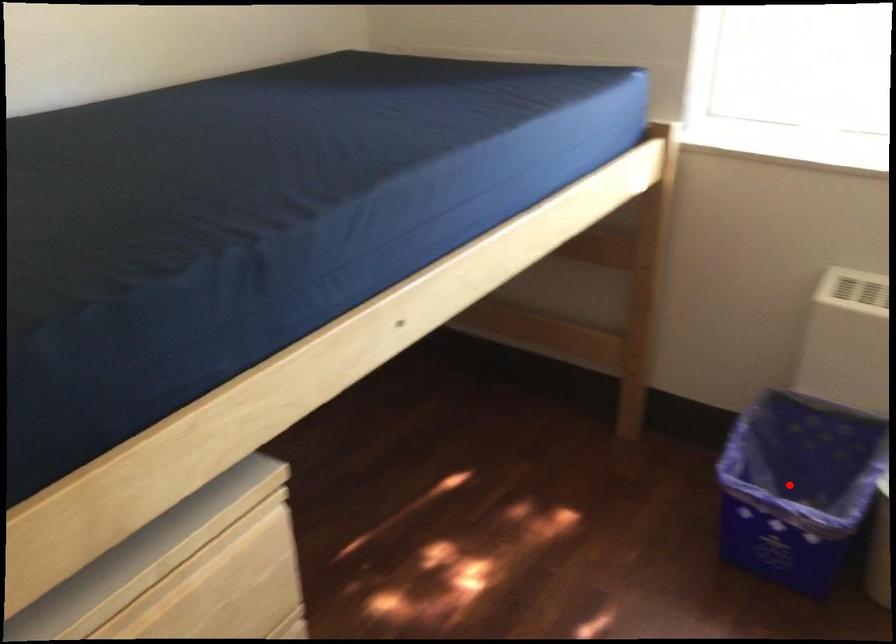
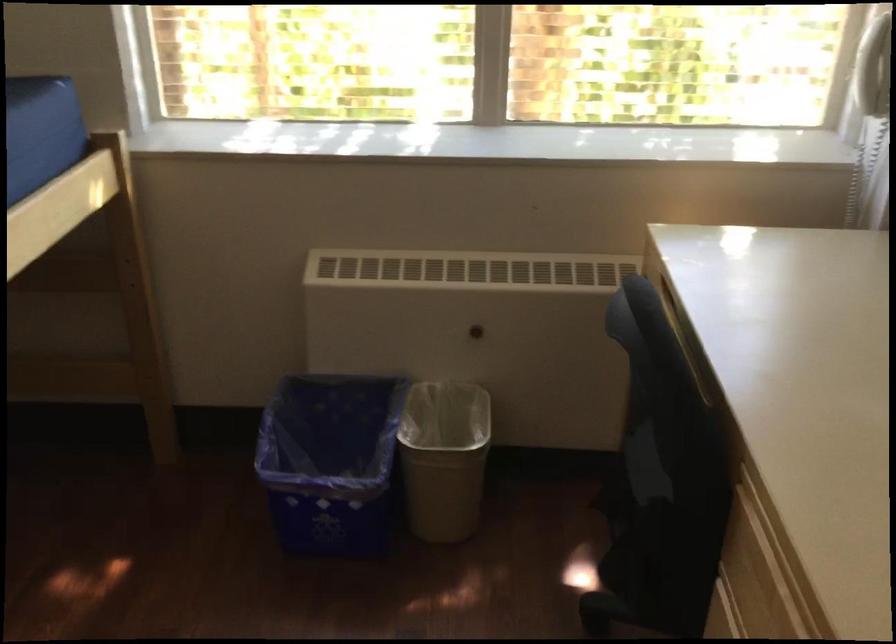
Question: I am providing you with two images of the same scene from different viewpoints. A red point is marked on the first image. Can you still see the location of the red point in image 2?

Choices:
 (A) Yes
 (B) No

Answer: (A)